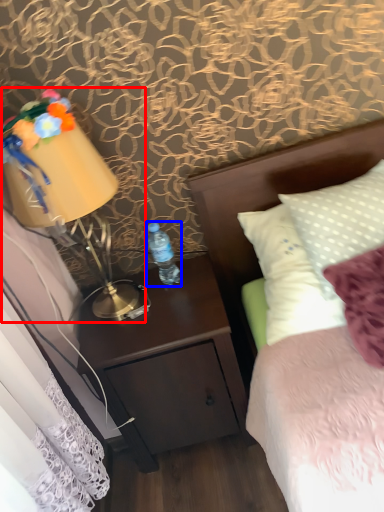
Question: Which of the following is the farthest to the observer, bedside lamp (highlighted by a red box) or bottle (highlighted by a blue box)?

Choices:
 (A) bedside lamp
 (B) bottle

Answer: (B)